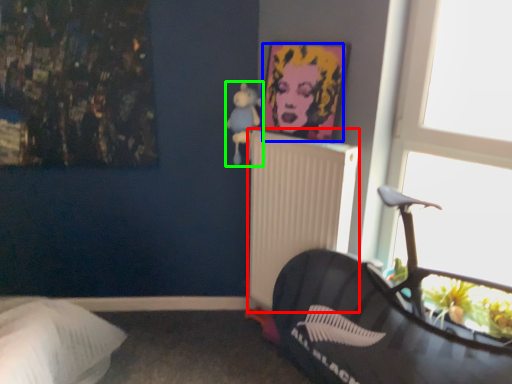
Question: Considering the real-world distances, which object is closest to radiator (highlighted by a red box)? person (highlighted by a blue box) or toy (highlighted by a green box).

Choices:
 (A) person
 (B) toy

Answer: (A)